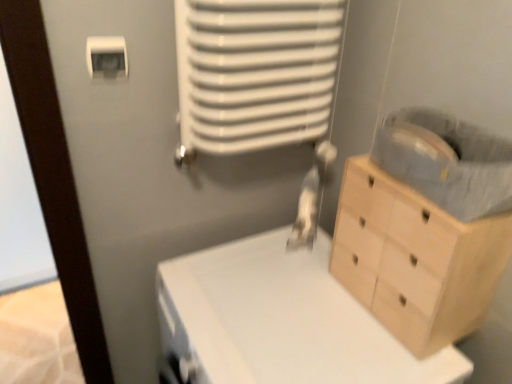
Question: Can you confirm if white matte changing table at center is taller than white plastic light switch at upper left?

Choices:
 (A) no
 (B) yes

Answer: (B)

Question: Could you tell me if white matte changing table at center is turned towards white plastic light switch at upper left?

Choices:
 (A) no
 (B) yes

Answer: (A)

Question: Is white matte changing table at center thinner than white plastic light switch at upper left?

Choices:
 (A) yes
 (B) no

Answer: (B)

Question: Considering the relative sizes of white matte changing table at center and white plastic light switch at upper left in the image provided, is white matte changing table at center wider than white plastic light switch at upper left?

Choices:
 (A) yes
 (B) no

Answer: (A)

Question: From a real-world perspective, is white matte changing table at center on top of white plastic light switch at upper left?

Choices:
 (A) no
 (B) yes

Answer: (A)

Question: Is white matte changing table at center facing away from white plastic light switch at upper left?

Choices:
 (A) no
 (B) yes

Answer: (A)

Question: Is white plastic light switch at upper left beside white matte changing table at center?

Choices:
 (A) no
 (B) yes

Answer: (A)

Question: Can you confirm if white plastic light switch at upper left is bigger than white matte changing table at center?

Choices:
 (A) no
 (B) yes

Answer: (A)

Question: Could you tell me if white plastic light switch at upper left is facing white matte changing table at center?

Choices:
 (A) yes
 (B) no

Answer: (B)

Question: From the image's perspective, would you say white plastic light switch at upper left is shown under white matte changing table at center?

Choices:
 (A) no
 (B) yes

Answer: (A)

Question: Is white plastic light switch at upper left not close to white matte changing table at center?

Choices:
 (A) no
 (B) yes

Answer: (A)

Question: Considering the relative sizes of white plastic light switch at upper left and white matte changing table at center in the image provided, is white plastic light switch at upper left thinner than white matte changing table at center?

Choices:
 (A) no
 (B) yes

Answer: (B)

Question: Is light wood chest of drawers at right in front of white plastic light switch at upper left?

Choices:
 (A) yes
 (B) no

Answer: (A)